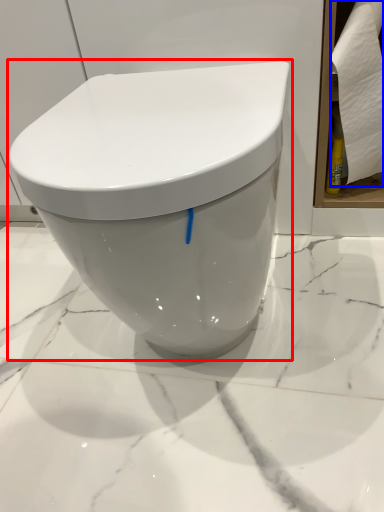
Question: Which point is further to the camera, toilet (highlighted by a red box) or toilet paper (highlighted by a blue box)?

Choices:
 (A) toilet
 (B) toilet paper

Answer: (B)